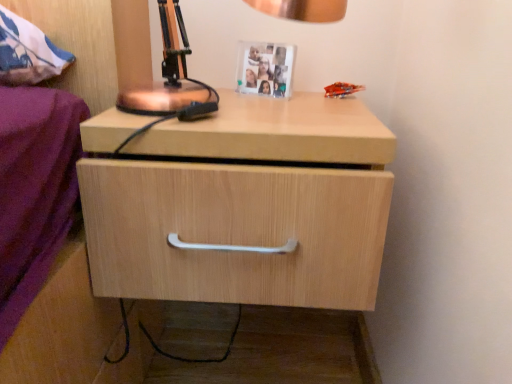
Question: Is copper metallic table lamp at upper center positioned behind white plastic picture frame at upper center?

Choices:
 (A) no
 (B) yes

Answer: (A)

Question: From a real-world perspective, is copper metallic table lamp at upper center located beneath white plastic picture frame at upper center?

Choices:
 (A) yes
 (B) no

Answer: (B)

Question: Can you confirm if copper metallic table lamp at upper center is taller than white plastic picture frame at upper center?

Choices:
 (A) no
 (B) yes

Answer: (B)

Question: From the image's perspective, is copper metallic table lamp at upper center beneath white plastic picture frame at upper center?

Choices:
 (A) yes
 (B) no

Answer: (A)

Question: Is copper metallic table lamp at upper center located outside white plastic picture frame at upper center?

Choices:
 (A) no
 (B) yes

Answer: (B)

Question: Is white plastic picture frame at upper center to the left or to the right of copper metallic table lamp at upper center in the image?

Choices:
 (A) left
 (B) right

Answer: (B)

Question: From the image's perspective, relative to copper metallic table lamp at upper center, is white plastic picture frame at upper center above or below?

Choices:
 (A) below
 (B) above

Answer: (B)

Question: In terms of width, does white plastic picture frame at upper center look wider or thinner when compared to copper metallic table lamp at upper center?

Choices:
 (A) thin
 (B) wide

Answer: (A)

Question: Does point tap(269, 81) appear closer or farther from the camera than point tap(324, 21)?

Choices:
 (A) closer
 (B) farther

Answer: (A)

Question: From the image's perspective, relative to light wood drawer at center, is copper metallic table lamp at upper center above or below?

Choices:
 (A) above
 (B) below

Answer: (A)

Question: Is copper metallic table lamp at upper center taller or shorter than light wood drawer at center?

Choices:
 (A) short
 (B) tall

Answer: (A)

Question: Is copper metallic table lamp at upper center in front of or behind light wood drawer at center in the image?

Choices:
 (A) behind
 (B) front

Answer: (B)

Question: Considering the positions of point click(x=159, y=6) and point click(x=282, y=228), is point click(x=159, y=6) closer or farther from the camera than point click(x=282, y=228)?

Choices:
 (A) closer
 (B) farther

Answer: (B)

Question: Considering the positions of point (229, 294) and point (167, 1), is point (229, 294) closer or farther from the camera than point (167, 1)?

Choices:
 (A) closer
 (B) farther

Answer: (A)

Question: Would you say light wood drawer at center is to the left or to the right of copper metallic table lamp at upper center in the picture?

Choices:
 (A) right
 (B) left

Answer: (A)